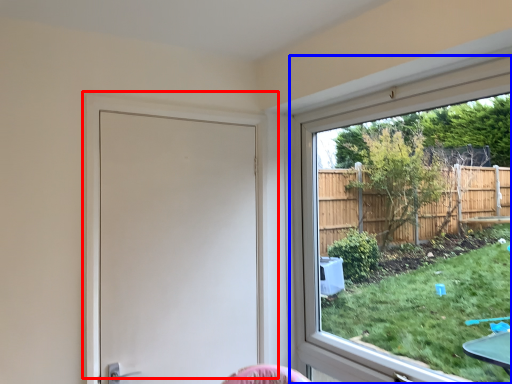
Question: Among these objects, which one is farthest to the camera, door (highlighted by a red box) or window (highlighted by a blue box)?

Choices:
 (A) door
 (B) window

Answer: (A)